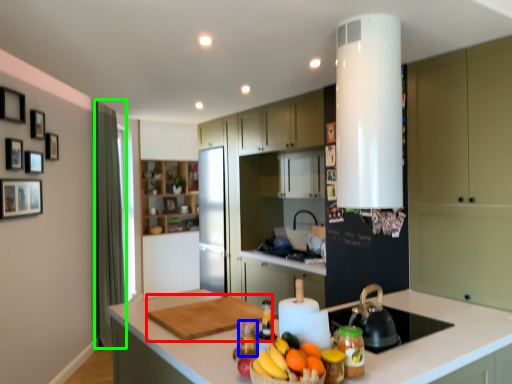
Question: Based on their relative distances, which object is farther from cutting board (highlighted by a red box)? Choose from bottle (highlighted by a blue box) and curtain (highlighted by a green box).

Choices:
 (A) bottle
 (B) curtain

Answer: (B)